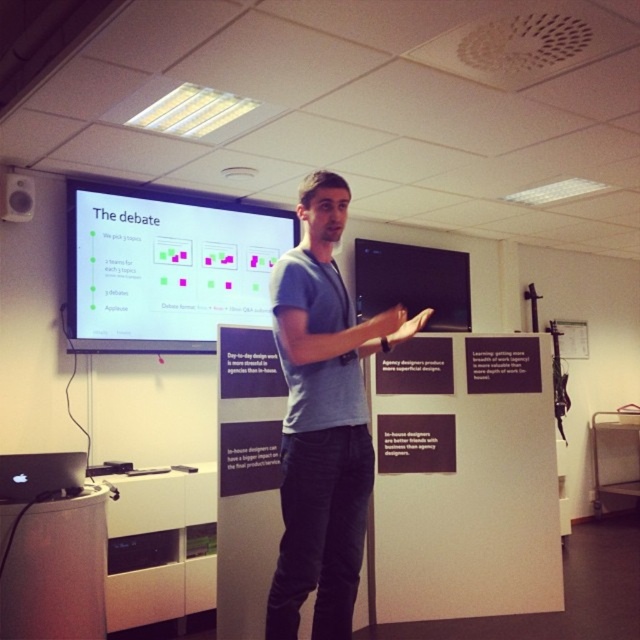
You are a participant in the meeting and want to focus on the slide. Which object should you look at first, the black glossy projection screen at upper center or the matte black speaker at upper left?

The black glossy projection screen at upper center is located below the matte black speaker at upper left, so you should look at the matte black speaker at upper left first as it is higher up.

You are a participant in the meeting and need to adjust the screen for better visibility. Which object, the black glossy projection screen at upper center or the matte black speaker at upper left, is closer to you so you can reach it without moving your chair?

The matte black speaker at upper left is closer to you than the black glossy projection screen at upper center, so you can reach it without moving your chair.